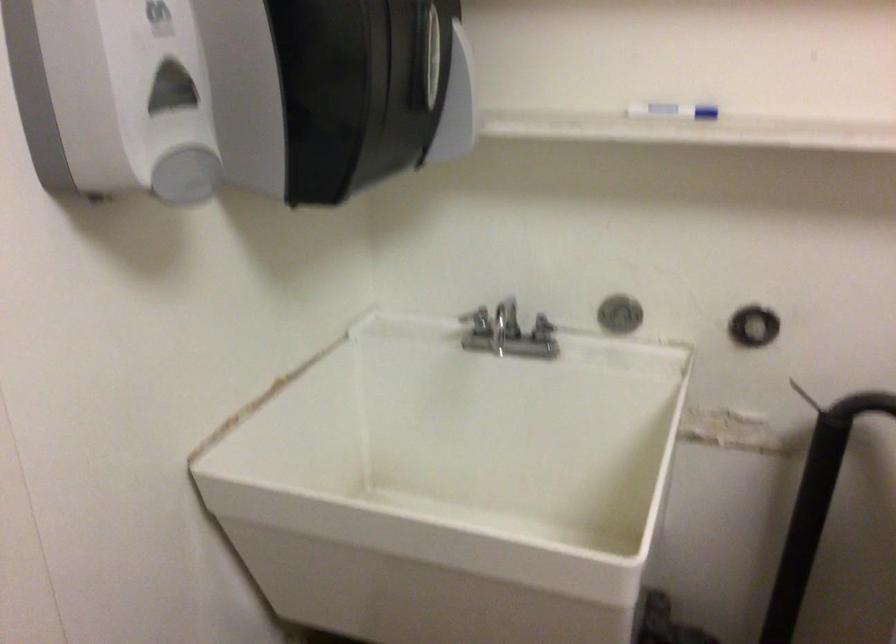
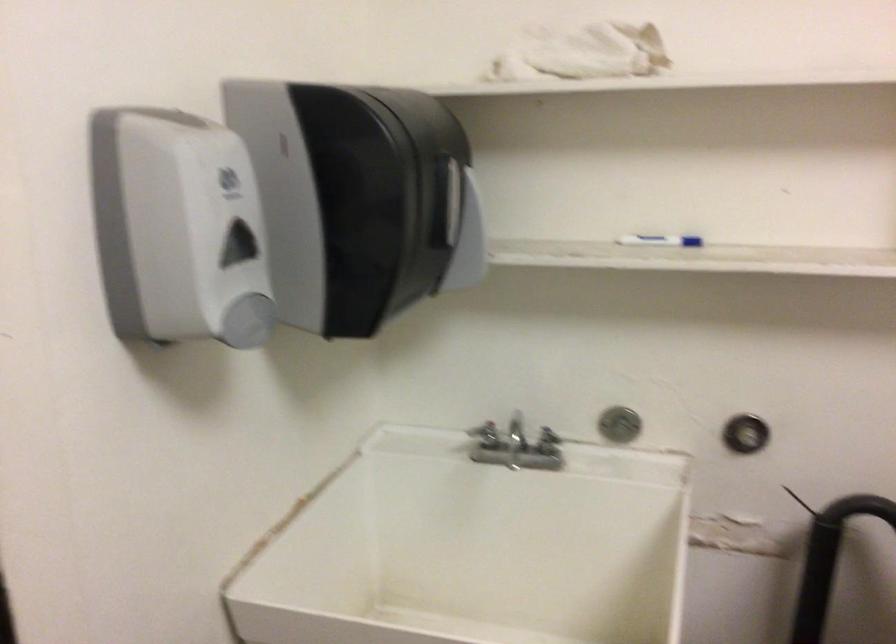
What movement of the cameraman would produce the second image?

The movement direction of the cameraman is left, backward.